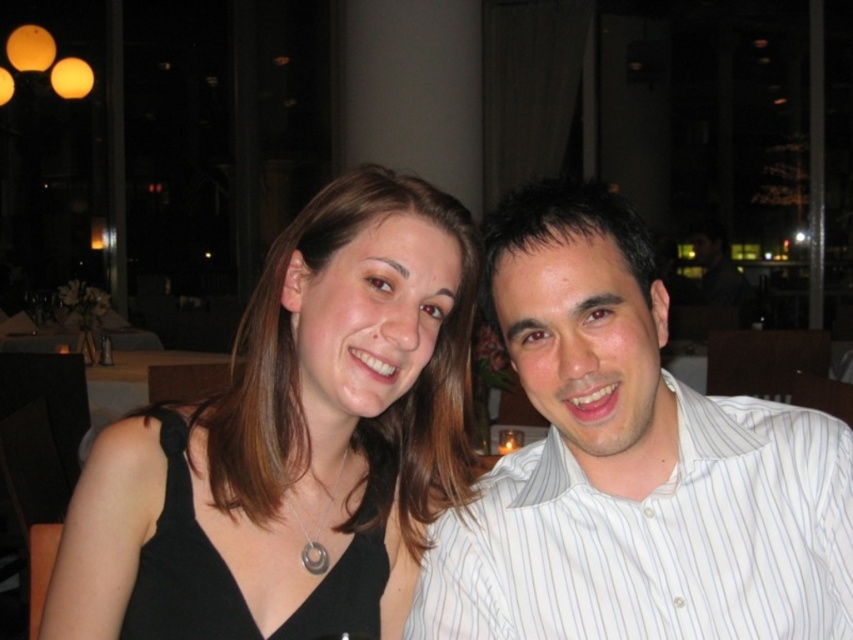
You are a photographer at a restaurant and notice two guests wearing the white striped shirt at center and the black fabric dress at left. You need to adjust the lighting so that the shorter garment is illuminated more. Which garment should you focus the light on?

The white striped shirt at center is shorter than the black fabric dress at left, so you should focus the light on the white striped shirt at center.

You are standing in a restaurant and want to place a 100 cm long tablecloth on the table. The table is located at point (492, 548). Can you determine if the tablecloth will fit on the table?

The distance of point (492, 548) from camera is 89.60 centimeters. Since the tablecloth is 100 cm long, it will extend beyond the table and may not fit properly.